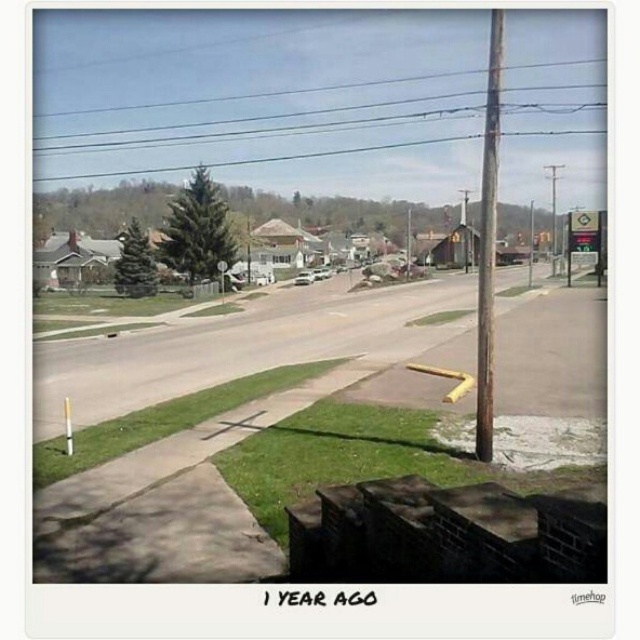
Who is more distant from viewer, [493,28] or [596,276]?

The point [596,276] is more distant.

Consider the image. Is brown wooden pole at center-right smaller than green plastic sign at upper right?

Actually, brown wooden pole at center-right might be larger than green plastic sign at upper right.

Does point (484, 161) lie behind point (568, 260)?

No, it is in front of (568, 260).

At what (x,y) coordinates should I click in order to perform the action: click on brown wooden pole at center-right. Please return your answer as a coordinate pair (x, y). This screenshot has width=640, height=640. Looking at the image, I should click on (486, 243).

Who is taller, brown wooden pole at center-right or metallic pole at right?

With more height is metallic pole at right.

This screenshot has height=640, width=640. Find the location of `brown wooden pole at center-right`. brown wooden pole at center-right is located at coordinates (486, 243).

The width and height of the screenshot is (640, 640). What are the coordinates of `green plastic sign at upper right` in the screenshot? It's located at (586, 237).

Between green plastic sign at upper right and metallic pole at right, which one appears on the left side from the viewer's perspective?

green plastic sign at upper right is more to the left.

Does point (573, 250) come closer to viewer compared to point (532, 212)?

Yes.

Where is `green plastic sign at upper right`? The width and height of the screenshot is (640, 640). green plastic sign at upper right is located at coordinates (586, 237).